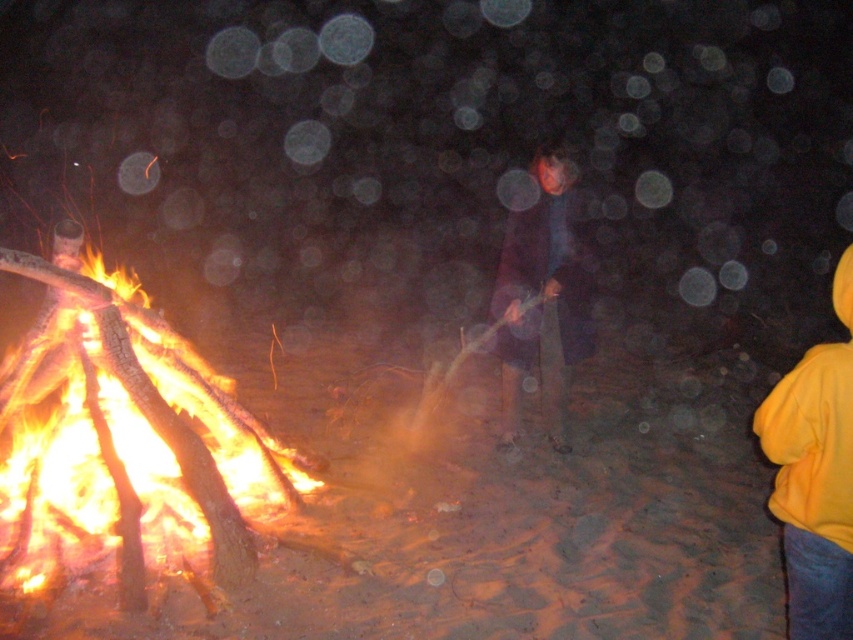
Question: Which object is positioned farthest from the yellow fleece jacket at lower right?

Choices:
 (A) dark blue fabric at center
 (B) flaming wood fire at left

Answer: (B)

Question: Does yellow fleece jacket at lower right appear under dark blue fabric at center?

Choices:
 (A) yes
 (B) no

Answer: (A)

Question: Is flaming wood fire at left bigger than yellow fleece jacket at lower right?

Choices:
 (A) yes
 (B) no

Answer: (A)

Question: Which object is farther from the camera taking this photo?

Choices:
 (A) dark blue fabric at center
 (B) yellow fleece jacket at lower right
 (C) flaming wood fire at left

Answer: (A)

Question: Does yellow fleece jacket at lower right appear over dark blue fabric at center?

Choices:
 (A) no
 (B) yes

Answer: (A)

Question: Which point appears farthest from the camera in this image?

Choices:
 (A) (219, 448)
 (B) (526, 355)
 (C) (786, 461)

Answer: (B)